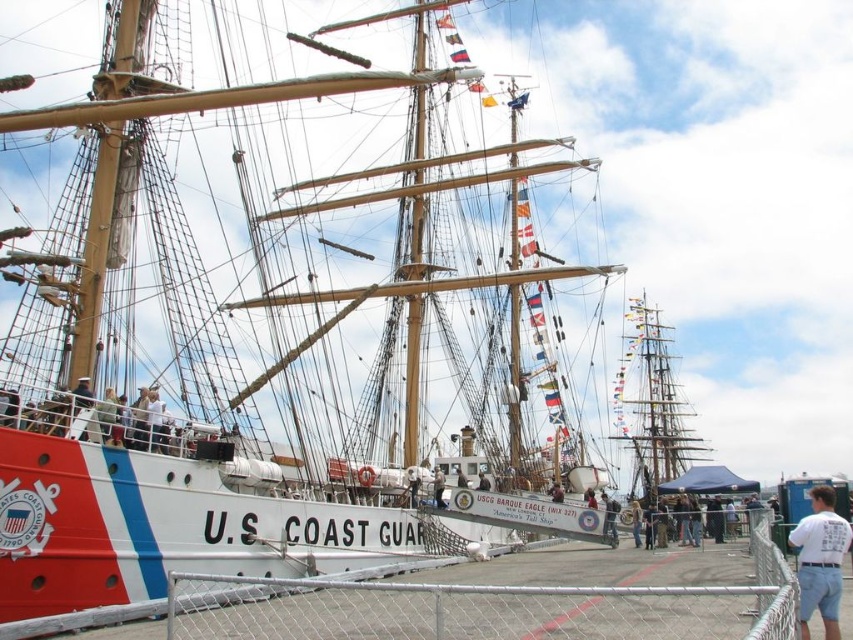
Question: Which of the following is the closest to the observer?

Choices:
 (A) dark blue uniform at center
 (B) light blue denim shorts at center

Answer: (B)

Question: Which object is positioned farthest from the white cotton shirt at center?

Choices:
 (A) light blue denim shorts at center
 (B) white t-shirt at center
 (C) white fabric shirt at center

Answer: (B)

Question: Does metal chain-link fence at lower center appear under white t-shirt at center?

Choices:
 (A) yes
 (B) no

Answer: (A)

Question: Based on their relative distances, which object is nearer to the light blue denim shorts at center?

Choices:
 (A) dark blue uniform at center
 (B) metal chain-link fence at lower center
 (C) white fabric shirt at center
 (D) white cotton shirt at center

Answer: (D)

Question: Does metal chain-link fence at lower center have a lesser width compared to white t-shirt at center?

Choices:
 (A) no
 (B) yes

Answer: (A)

Question: Does light blue denim shorts at center come in front of dark blue uniform at center?

Choices:
 (A) no
 (B) yes

Answer: (B)